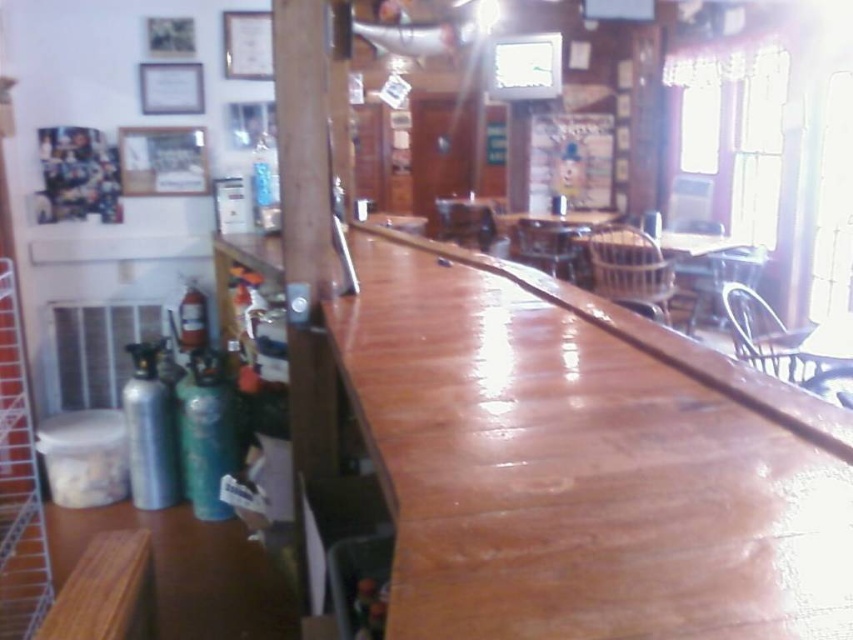
Who is taller, metallic green gas canister at left or red glass fire extinguisher at left?

Standing taller between the two is metallic green gas canister at left.

Is metallic green gas canister at left smaller than red glass fire extinguisher at left?

Incorrect, metallic green gas canister at left is not smaller in size than red glass fire extinguisher at left.

The width and height of the screenshot is (853, 640). What do you see at coordinates (149, 432) in the screenshot?
I see `metallic green gas canister at left` at bounding box center [149, 432].

This screenshot has width=853, height=640. Find the location of `metallic green gas canister at left`. metallic green gas canister at left is located at coordinates [149, 432].

Between point (213, 365) and point (202, 332), which one is positioned in front?

Point (213, 365)

Looking at this image, who is more forward, (228,422) or (181,349)?

Point (228,422) is in front.

Locate an element on the screen. This screenshot has height=640, width=853. green matte gas canister at lower left is located at coordinates (207, 433).

Between wooden plank at lower left and red glass fire extinguisher at left, which one is positioned higher?

Positioned higher is red glass fire extinguisher at left.

Is wooden plank at lower left positioned before red glass fire extinguisher at left?

Yes, it is in front of red glass fire extinguisher at left.

Where is `wooden plank at lower left`? This screenshot has height=640, width=853. wooden plank at lower left is located at coordinates (189, 572).